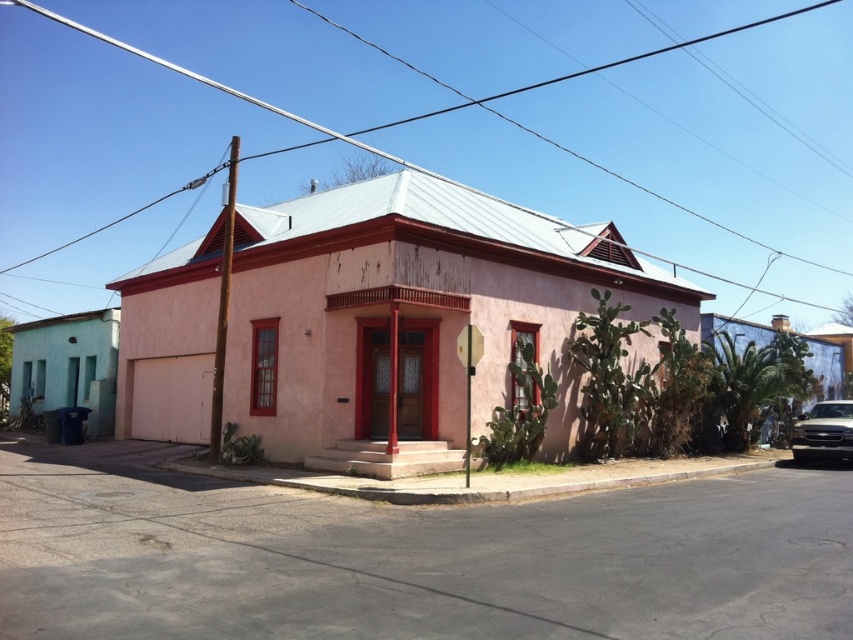
Does gray concrete curb at lower center appear on the right side of gold metallic car at lower right?

Incorrect, gray concrete curb at lower center is not on the right side of gold metallic car at lower right.

Is point (764, 458) positioned after point (842, 422)?

Yes, point (764, 458) is behind point (842, 422).

Locate an element on the screen. Image resolution: width=853 pixels, height=640 pixels. gray concrete curb at lower center is located at coordinates (485, 480).

Does metallic wire at upper center have a lesser width compared to gold metallic car at lower right?

In fact, metallic wire at upper center might be wider than gold metallic car at lower right.

Between metallic wire at upper center and gold metallic car at lower right, which one has more height?

Standing taller between the two is metallic wire at upper center.

Locate an element on the screen. This screenshot has width=853, height=640. metallic wire at upper center is located at coordinates [577, 115].

Between metallic wire at upper center and gray concrete curb at lower center, which one is positioned higher?

metallic wire at upper center is above.

How distant is metallic wire at upper center from gray concrete curb at lower center?

metallic wire at upper center is 203.01 feet away from gray concrete curb at lower center.

Is point (764, 61) farther from viewer compared to point (721, 464)?

Yes, it is behind point (721, 464).

Locate an element on the screen. This screenshot has height=640, width=853. metallic wire at upper center is located at coordinates (577, 115).